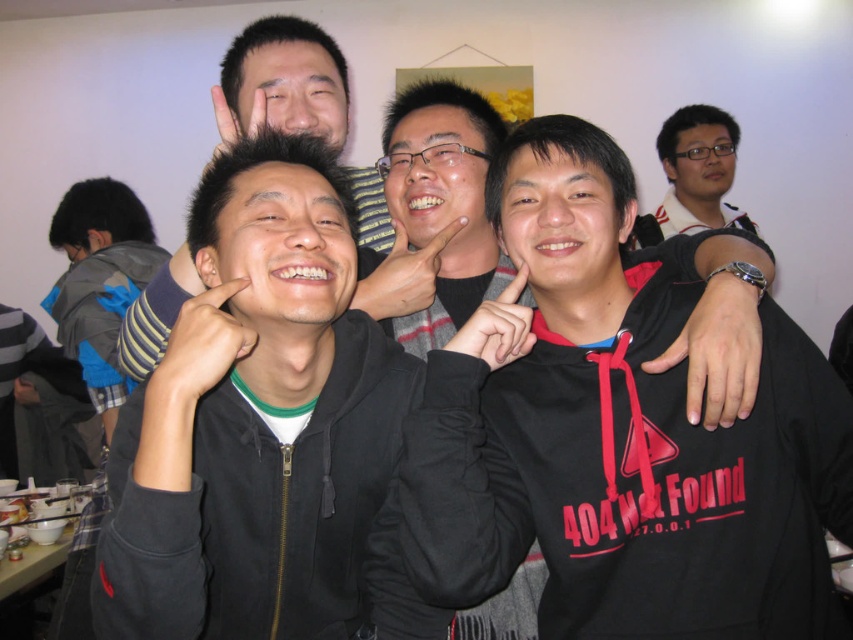
Which of these two, black leather wristwatch at lower right or matte black hand at center, stands shorter?

With less height is matte black hand at center.

Who is positioned more to the left, black leather wristwatch at lower right or matte black hand at center?

matte black hand at center

Locate an element on the screen. The image size is (853, 640). black leather wristwatch at lower right is located at coordinates (718, 352).

Is black matte hand at center above matte black hand at upper center?

Actually, black matte hand at center is below matte black hand at upper center.

Which is below, black matte hand at center or matte black hand at upper center?

Positioned lower is black matte hand at center.

Which is in front, point (177, 380) or point (265, 106)?

Point (177, 380)

Where is `black matte hand at center`? This screenshot has height=640, width=853. black matte hand at center is located at coordinates (200, 348).

What do you see at coordinates (404, 275) in the screenshot? This screenshot has width=853, height=640. I see `matte skin hand at center` at bounding box center [404, 275].

Does matte skin hand at center have a larger size compared to matte black hand at upper center?

Incorrect, matte skin hand at center is not larger than matte black hand at upper center.

From the picture: Who is more forward, (398, 225) or (231, 138)?

Point (231, 138) is in front.

This screenshot has width=853, height=640. I want to click on matte skin hand at center, so click(x=404, y=275).